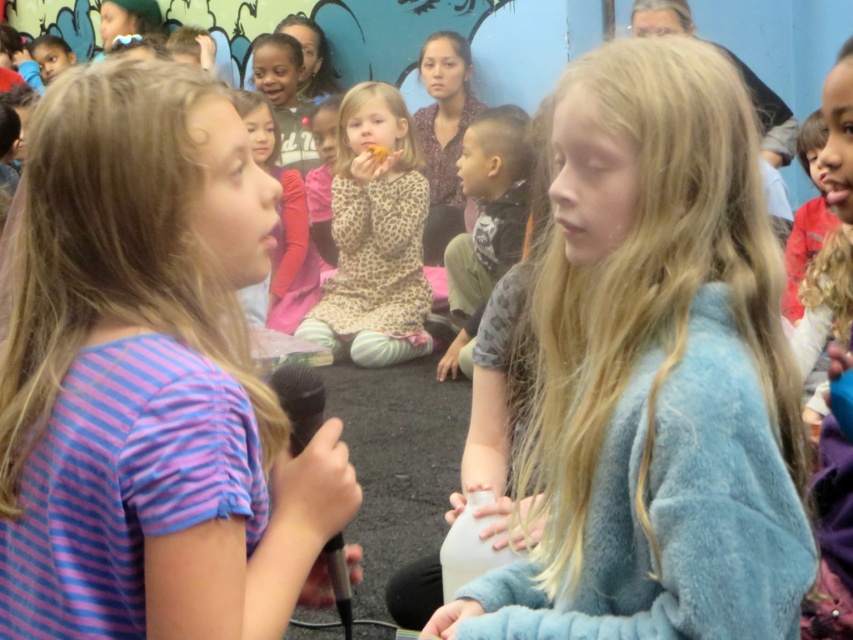
You are organizing a school play and need to ensure that all props and costumes are properly stored after the performance. Given the purple striped shirt at center and the white matte bottle at center, which item should be placed in a larger storage container to accommodate its size?

The purple striped shirt at center is larger in size than the white matte bottle at center, so the purple striped shirt at center requires a larger storage container.

In the scene shown: You are a photographer setting up for a group photo. You notice two central items in the scene, the blue fuzzy sweater at center and the leopard print dress at center. From the photographer perspective, which one is positioned to the right?

The blue fuzzy sweater at center is positioned to the right of the leopard print dress at center.

You are a photographer trying to capture both the blue fuzzy sweater at center and the leopard print dress at center in a single frame. Which object should you focus on first to ensure both are in the frame?

The blue fuzzy sweater at center is smaller than the leopard print dress at center, so you should focus on the leopard print dress at center first to ensure both fit in the frame.